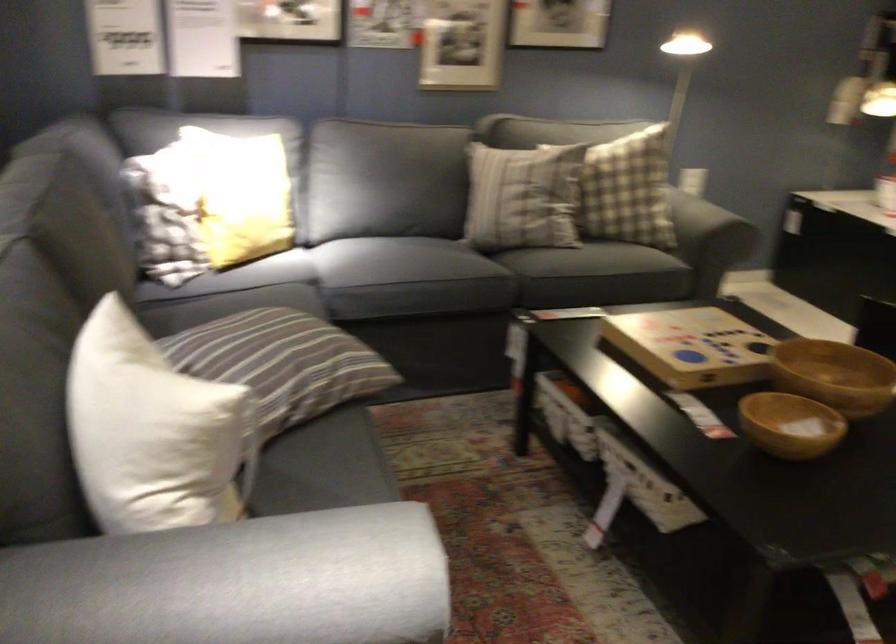
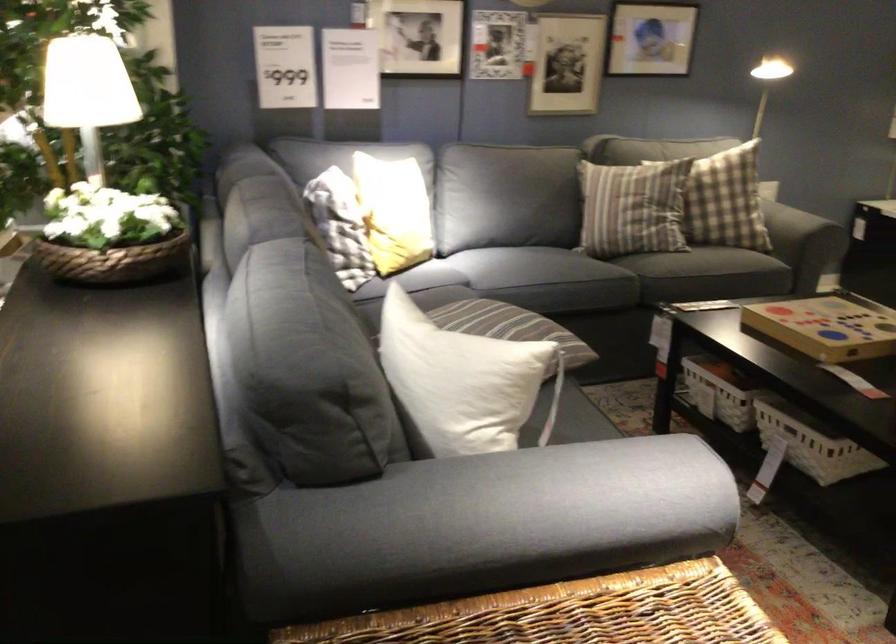
The point at (150,427) is marked in the first image. Where is the corresponding point in the second image?

(462, 381)